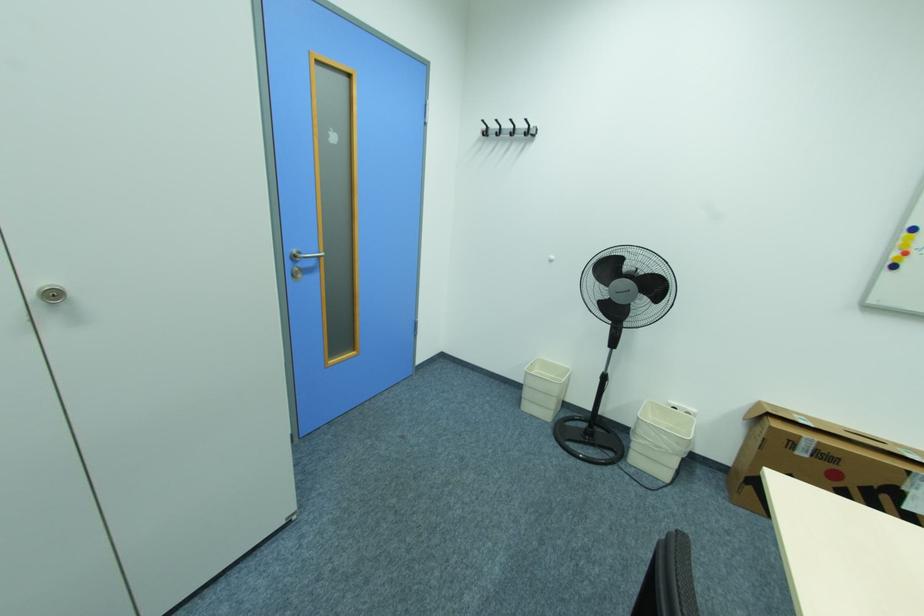
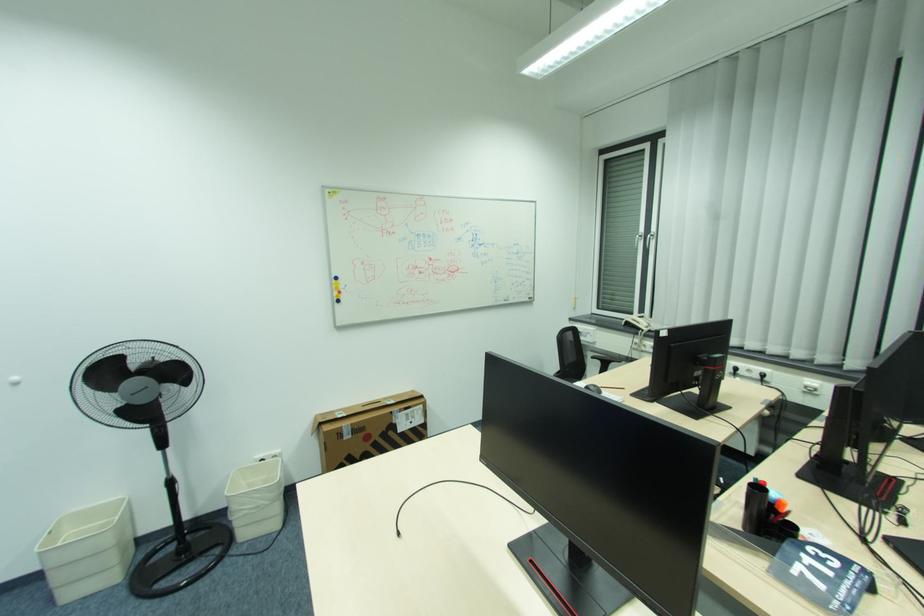
Where in the second image is the point corresponding to pixel 574 370 from the first image?

(128, 500)